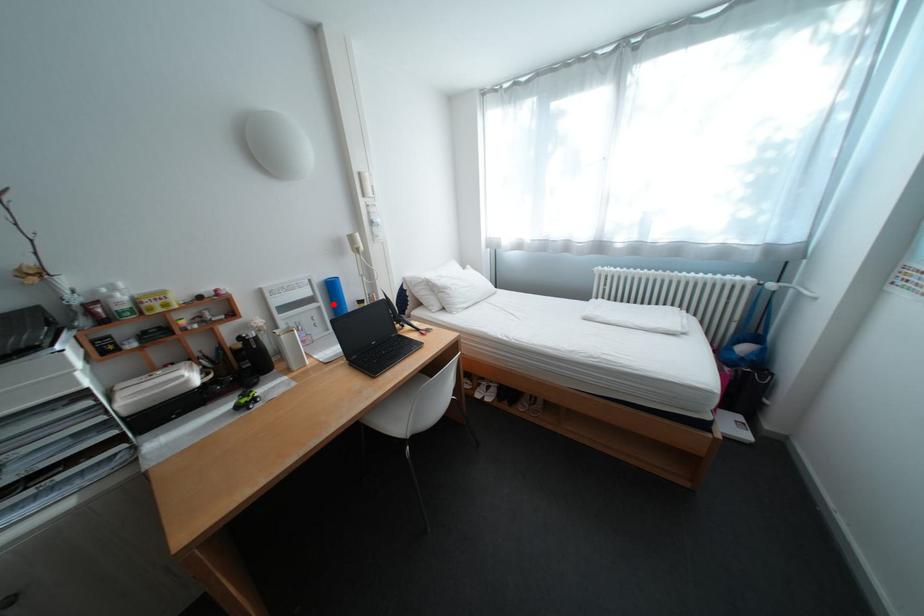
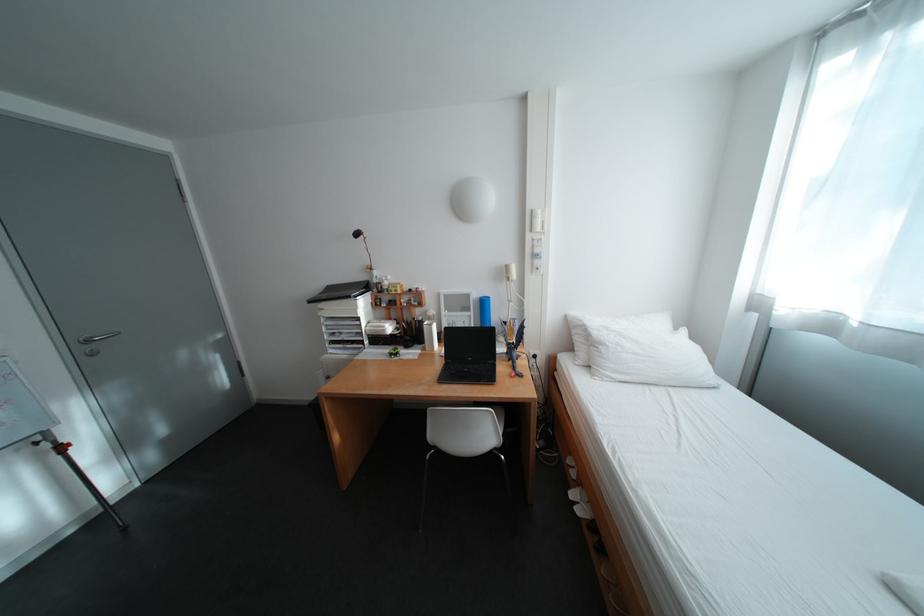
Find the pixel in the second image that matches the highlighted location in the first image.

(484, 314)